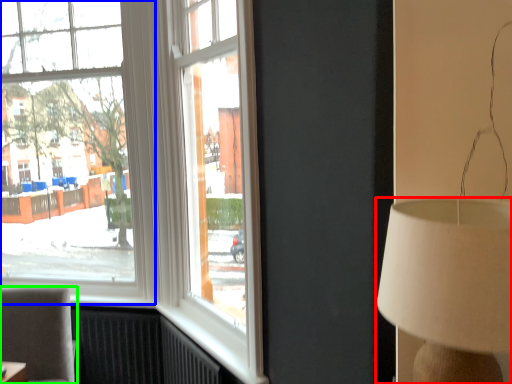
Question: Considering the real-world distances, which object is farthest from lamp (highlighted by a red box)? window (highlighted by a blue box) or furniture (highlighted by a green box)?

Choices:
 (A) window
 (B) furniture

Answer: (A)